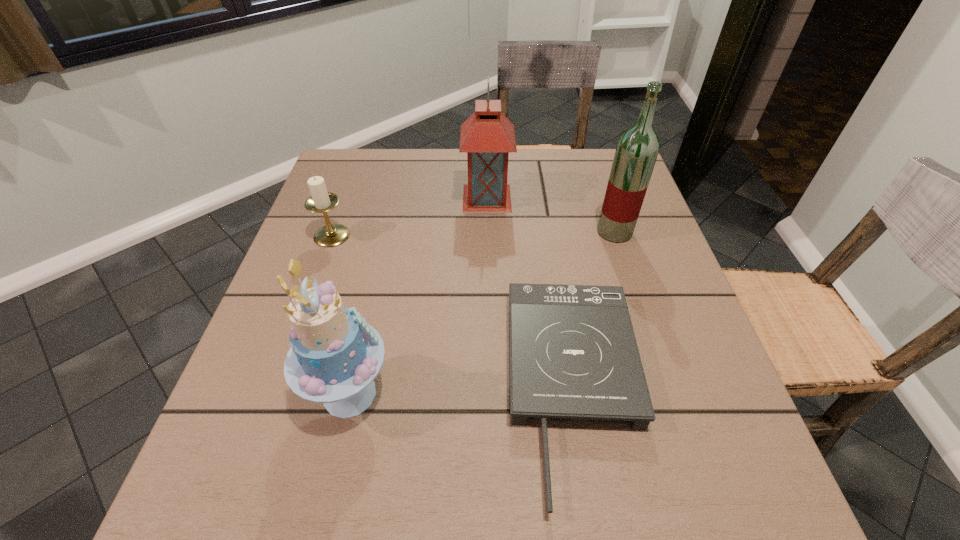
Find the location of a particular element. Image resolution: width=960 pixels, height=540 pixels. vacant region at the left edge is located at coordinates (350, 230).

Locate an element on the screen. Image resolution: width=960 pixels, height=540 pixels. vacant space at the right edge of the desktop is located at coordinates (646, 312).

In the image, there is a desktop. At what (x,y) coordinates should I click in order to perform the action: click on free space at the near left corner. Please return your answer as a coordinate pair (x, y). The height and width of the screenshot is (540, 960). Looking at the image, I should click on (240, 488).

This screenshot has width=960, height=540. In the image, there is a desktop. Find the location of `vacant area at the near right corner`. vacant area at the near right corner is located at coordinates (762, 496).

Identify the location of free area in between the liquor and the second object from left to right. This screenshot has width=960, height=540. (482, 313).

Identify the location of empty location between the liquor and the lantern. (551, 215).

Locate an element on the screen. The image size is (960, 540). vacant region between the lantern and the fourth object from right to left is located at coordinates (419, 296).

Find the location of a particular element. free space between the hotplate and the second shortest object is located at coordinates (453, 312).

Image resolution: width=960 pixels, height=540 pixels. I want to click on free space between the second object from left to right and the liquor, so click(x=482, y=313).

The image size is (960, 540). I want to click on empty space between the farthest object and the liquor, so click(x=551, y=215).